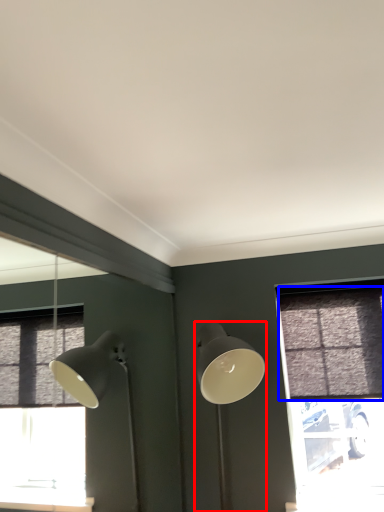
Question: Which of the following is the farthest to the observer, lamp (highlighted by a red box) or curtain (highlighted by a blue box)?

Choices:
 (A) lamp
 (B) curtain

Answer: (B)